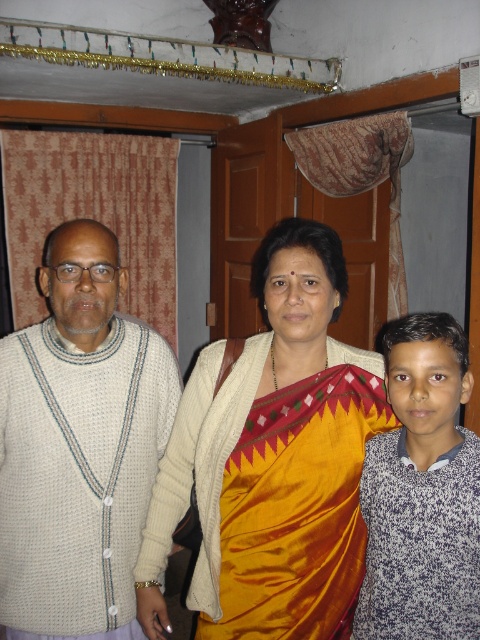
You are organizing a photo album and need to label the positions of the silk sari at center and the white knitted sweater at left. Based on the scene, which object is positioned to the right of the other?

The silk sari at center is positioned to the right of the white knitted sweater at left.

You are a photographer setting up a three person portrait. You have a camera that can capture a maximum width of 2 meters. The silk sari at center and the white speckled sweater at right are the main subjects. Based on their widths, will both fit within the camera frame?

The silk sari at center might be wider than white speckled sweater at right, so it is uncertain if both will fit within the 2 meter frame. Check the exact width of the silk sari first.